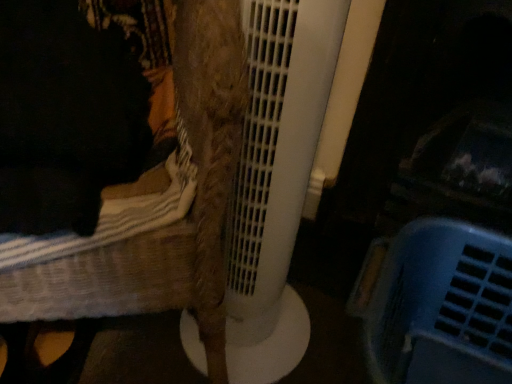
Identify the location of blue plastic basket at lower right. (442, 306).

This screenshot has height=384, width=512. Describe the element at coordinates (442, 306) in the screenshot. I see `blue plastic basket at lower right` at that location.

This screenshot has height=384, width=512. I want to click on woven fabric chair at left, so click(x=178, y=222).

Image resolution: width=512 pixels, height=384 pixels. Describe the element at coordinates (178, 222) in the screenshot. I see `woven fabric chair at left` at that location.

The image size is (512, 384). Identify the location of blue plastic basket at lower right. (442, 306).

Considering the positions of objects blue plastic basket at lower right and woven fabric chair at left in the image provided, who is more to the right, blue plastic basket at lower right or woven fabric chair at left?

From the viewer's perspective, blue plastic basket at lower right appears more on the right side.

Is the position of blue plastic basket at lower right more distant than that of woven fabric chair at left?

Yes, the depth of blue plastic basket at lower right is greater than that of woven fabric chair at left.

Is point (476, 365) positioned after point (199, 28)?

Yes, it is behind point (199, 28).

From the image's perspective, is blue plastic basket at lower right above or below woven fabric chair at left?

Clearly, from the image's perspective, blue plastic basket at lower right is below woven fabric chair at left.

From a real-world perspective, which object rests below the other?

blue plastic basket at lower right.

Which of these two, blue plastic basket at lower right or woven fabric chair at left, is thinner?

blue plastic basket at lower right.

Can you confirm if blue plastic basket at lower right is taller than woven fabric chair at left?

No.

In the scene shown: Can you confirm if blue plastic basket at lower right is smaller than woven fabric chair at left?

Yes.

Is blue plastic basket at lower right spatially inside woven fabric chair at left, or outside of it?

blue plastic basket at lower right is spatially situated outside woven fabric chair at left.

Is blue plastic basket at lower right directly adjacent to woven fabric chair at left?

No, blue plastic basket at lower right is not beside woven fabric chair at left.

Is blue plastic basket at lower right positioned with its back to woven fabric chair at left?

No, blue plastic basket at lower right's orientation is not away from woven fabric chair at left.

How many degrees apart are the facing directions of blue plastic basket at lower right and woven fabric chair at left?

They differ by 33.5 degrees in their facing directions.

How distant is blue plastic basket at lower right from woven fabric chair at left?

blue plastic basket at lower right is 39.61 centimeters from woven fabric chair at left.

The width and height of the screenshot is (512, 384). Identify the location of furniture on the left of blue plastic basket at lower right. (178, 222).

Does woven fabric chair at left appear on the right side of blue plastic basket at lower right?

No.

Which object is further away from the camera taking this photo, woven fabric chair at left or blue plastic basket at lower right?

blue plastic basket at lower right is further away from the camera.

Considering the positions of point (231, 157) and point (384, 299), is point (231, 157) closer or farther from the camera than point (384, 299)?

Point (231, 157) appears to be closer to the viewer than point (384, 299).

From the image's perspective, is woven fabric chair at left located above blue plastic basket at lower right?

Yes, from the image's perspective, woven fabric chair at left is above blue plastic basket at lower right.

From a real-world perspective, which is physically below, woven fabric chair at left or blue plastic basket at lower right?

In real-world perspective, blue plastic basket at lower right is lower.

Is woven fabric chair at left thinner than blue plastic basket at lower right?

In fact, woven fabric chair at left might be wider than blue plastic basket at lower right.

Is woven fabric chair at left shorter than blue plastic basket at lower right?

In fact, woven fabric chair at left may be taller than blue plastic basket at lower right.

Considering the sizes of objects woven fabric chair at left and blue plastic basket at lower right in the image provided, who is smaller, woven fabric chair at left or blue plastic basket at lower right?

Smaller between the two is blue plastic basket at lower right.

Is woven fabric chair at left situated inside blue plastic basket at lower right or outside?

woven fabric chair at left is not enclosed by blue plastic basket at lower right.

Is woven fabric chair at left far from blue plastic basket at lower right?

No, woven fabric chair at left is not far away from blue plastic basket at lower right.

Consider the image. Is woven fabric chair at left aimed at blue plastic basket at lower right?

No.

What's the angular difference between woven fabric chair at left and blue plastic basket at lower right's facing directions?

There is a 33.5-degree angle between the facing directions of woven fabric chair at left and blue plastic basket at lower right.

This screenshot has width=512, height=384. Find the location of `furniture in front of the blue plastic basket at lower right`. furniture in front of the blue plastic basket at lower right is located at coordinates (178, 222).

Identify the location of furniture on the left side of blue plastic basket at lower right. The height and width of the screenshot is (384, 512). (178, 222).

Locate an element on the screen. The height and width of the screenshot is (384, 512). furniture that is above the blue plastic basket at lower right (from the image's perspective) is located at coordinates (178, 222).